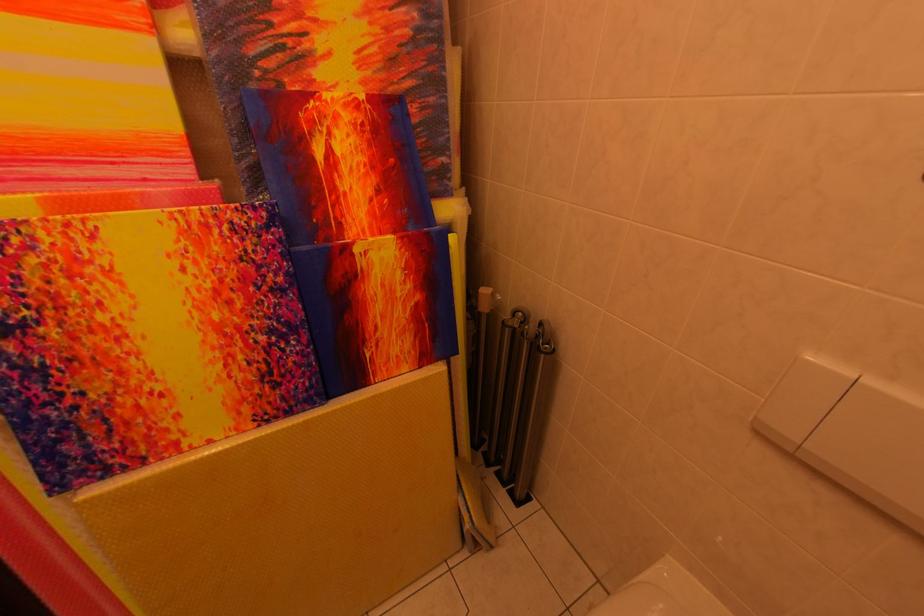
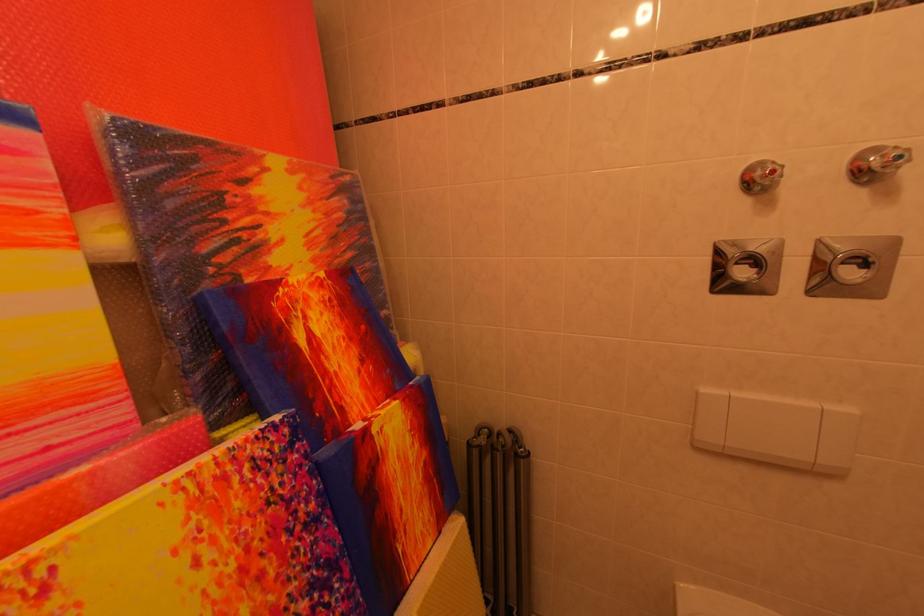
Locate, in the second image, the point that corresponds to point (248, 308) in the first image.

(281, 575)